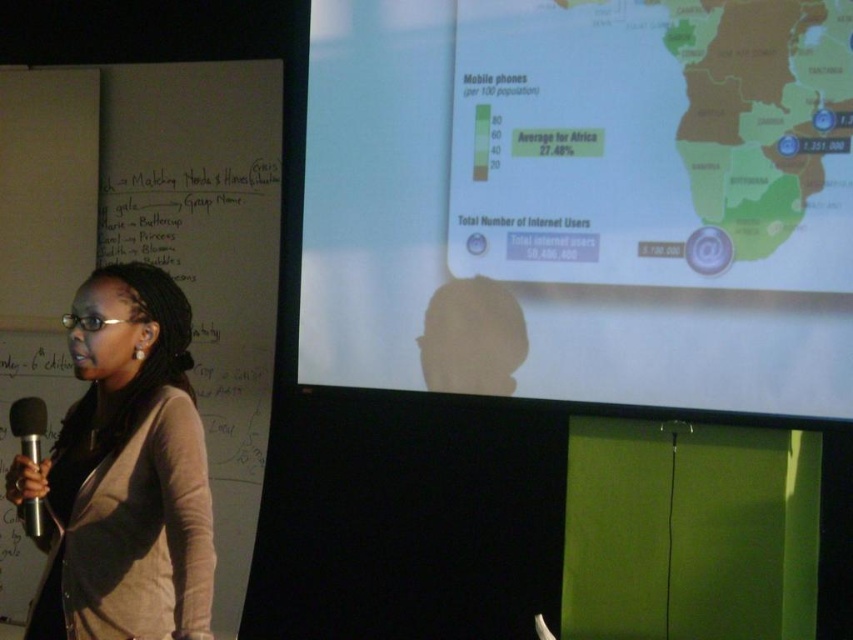
You are an attendee at this presentation and want to see the presenter and the projection screen clearly. Is the matte black jacket at left blocking your view of the white matte projection screen at upper center?

The matte black jacket at left is behind the white matte projection screen at upper center, so it does not block the view of the screen.

You are an event organizer setting up for a presentation. You have a white matte projection screen at upper center and a silver metallic microphone at lower left. Which object is wider?

The white matte projection screen at upper center is wider than the silver metallic microphone at lower left.